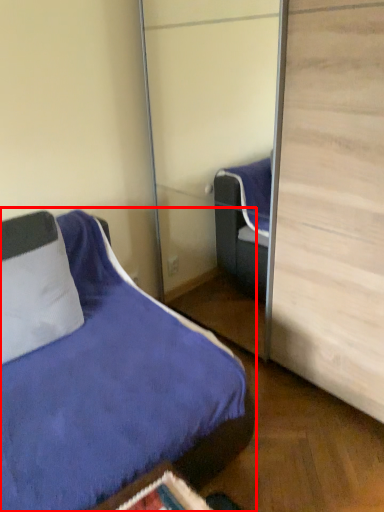
Question: From the image's perspective, where is bed (annotated by the red box) located relative to pillow?

Choices:
 (A) below
 (B) above

Answer: (A)